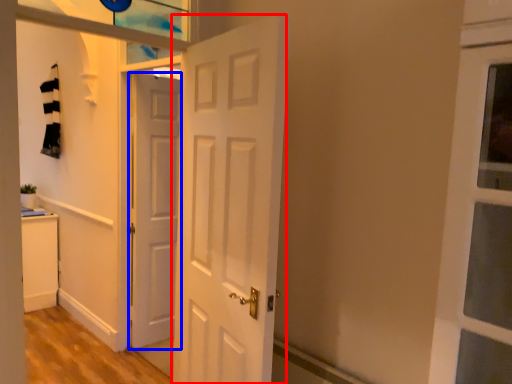
Question: Which of the following is the closest to the observer, door (highlighted by a red box) or door (highlighted by a blue box)?

Choices:
 (A) door
 (B) door

Answer: (A)